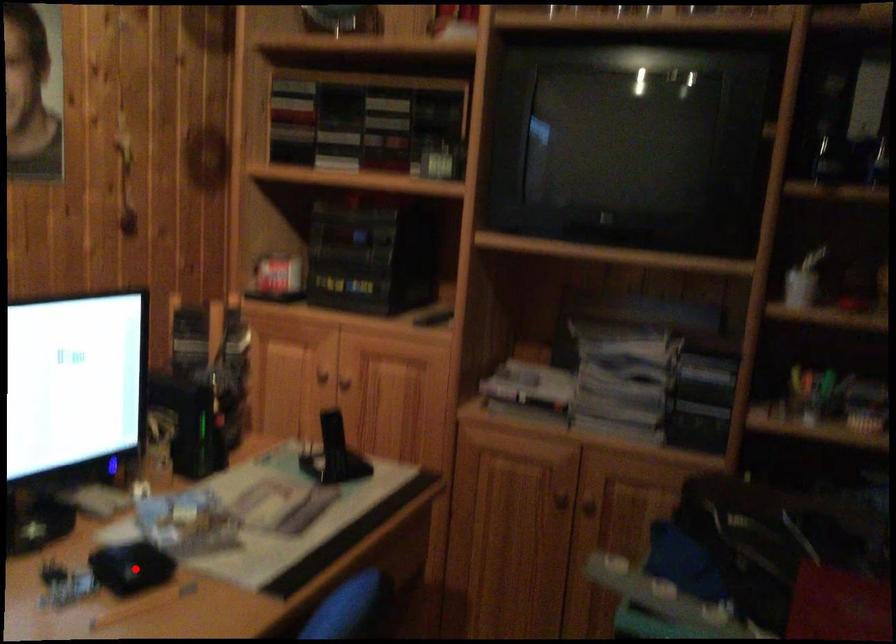
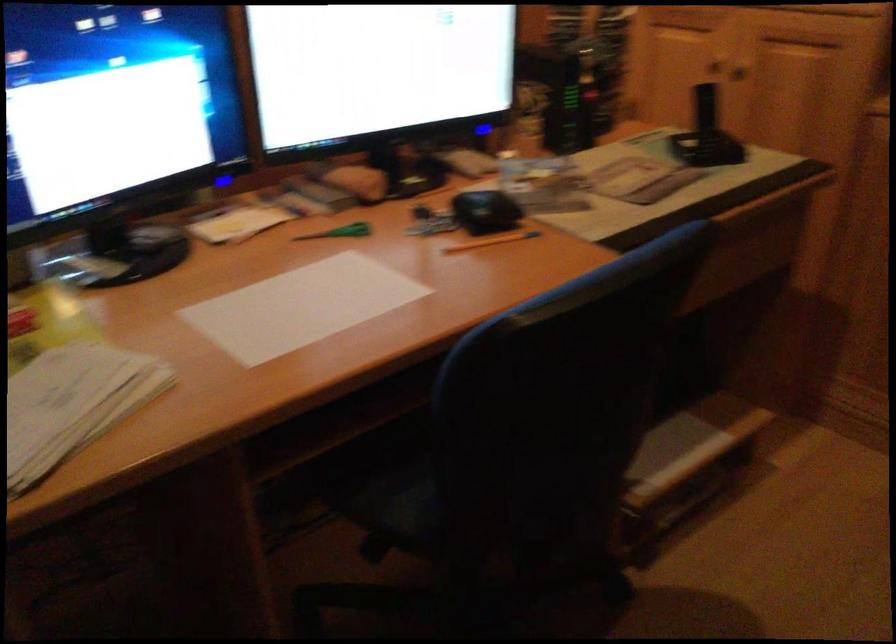
In the second image, find the point that corresponds to the highlighted location in the first image.

(486, 211)